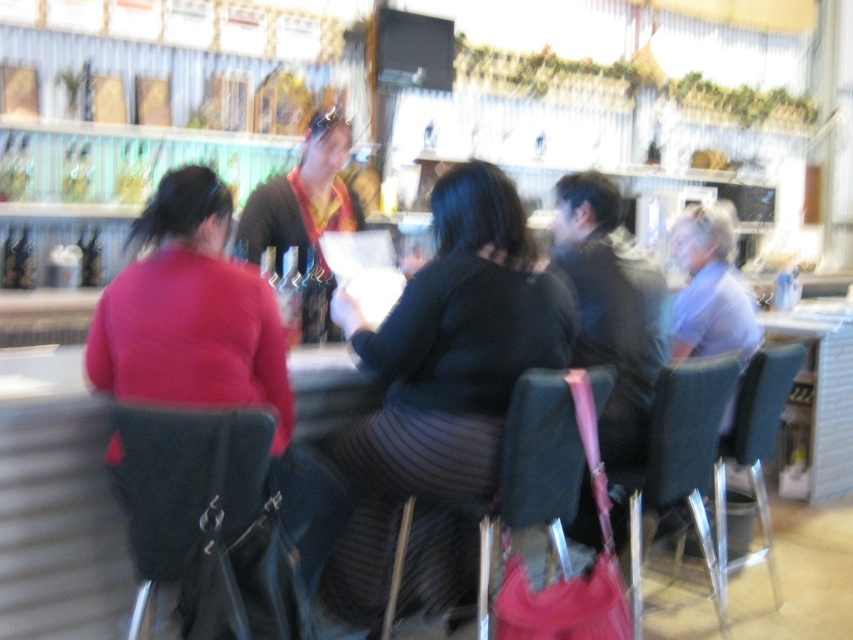
You are a barista trying to seat a customer who prefers a taller chair. Which chair between the black leather chair at left and the teal fabric chair at right would you recommend?

The teal fabric chair at right is taller than the black leather chair at left, so you should recommend the teal fabric chair at right.

You are standing at the point marked as point [114,408] in the image. You want to take a photo of the entire scene. If the camera is 5.59 feet away from the point, will you be able to capture everyone at the bar counter in the photo?

Yes, because the camera is positioned 5.59 feet away from the point [114,408], which should provide a sufficient distance to capture the entire bar counter and all four individuals in the photo.

In the scene shown: You are standing at the entrance of the cafe and want to sit at the black textured sweater at center. Which direction should you walk to reach it?

The black textured sweater at center is located at point 0.620 on the x axis and 0.518 on the y axis. Since the entrance is typically at the front of the cafe, you would need to walk towards the center of the room to reach the black textured sweater at center.